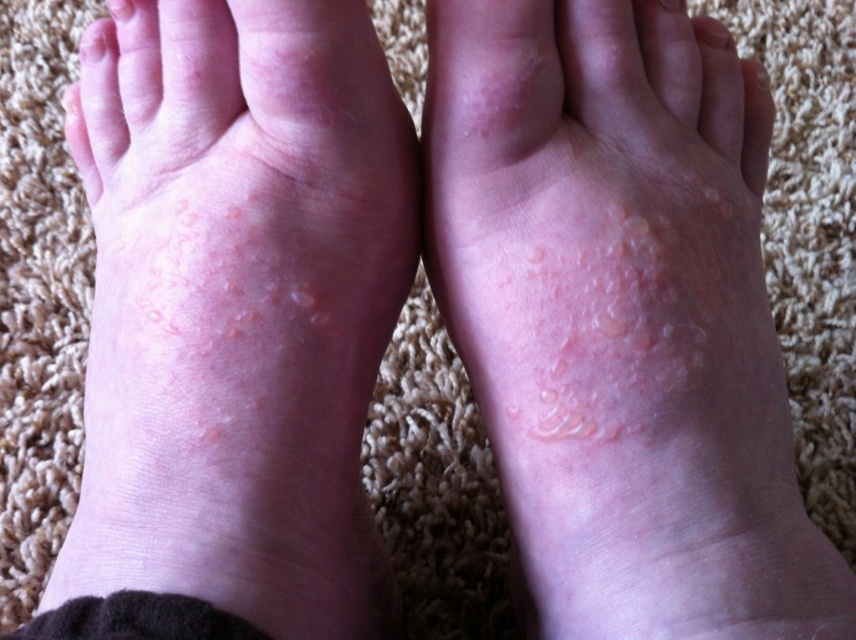
Question: Considering the relative positions of dry skin patches at lower left and smooth skin at lower center in the image provided, where is dry skin patches at lower left located with respect to smooth skin at lower center?

Choices:
 (A) right
 (B) left

Answer: (A)

Question: Which object is positioned closest to the dry skin patches at center?

Choices:
 (A) smooth skin at lower center
 (B) dry skin patches at lower left
 (C) dry skin at upper left
 (D) smooth skin at upper center

Answer: (B)

Question: Can you confirm if smooth skin at lower center is wider than dry skin at upper left?

Choices:
 (A) no
 (B) yes

Answer: (B)

Question: Is dry skin patches at lower left wider than dry skin at upper left?

Choices:
 (A) no
 (B) yes

Answer: (B)

Question: Which of the following is the closest to the observer?

Choices:
 (A) (191, 611)
 (B) (111, 3)

Answer: (A)

Question: Estimate the real-world distances between objects in this image. Which object is farther from the dry skin at upper left?

Choices:
 (A) smooth skin at upper center
 (B) smooth skin at lower center
 (C) dry skin patches at center
 (D) dry skin patches at lower left

Answer: (A)